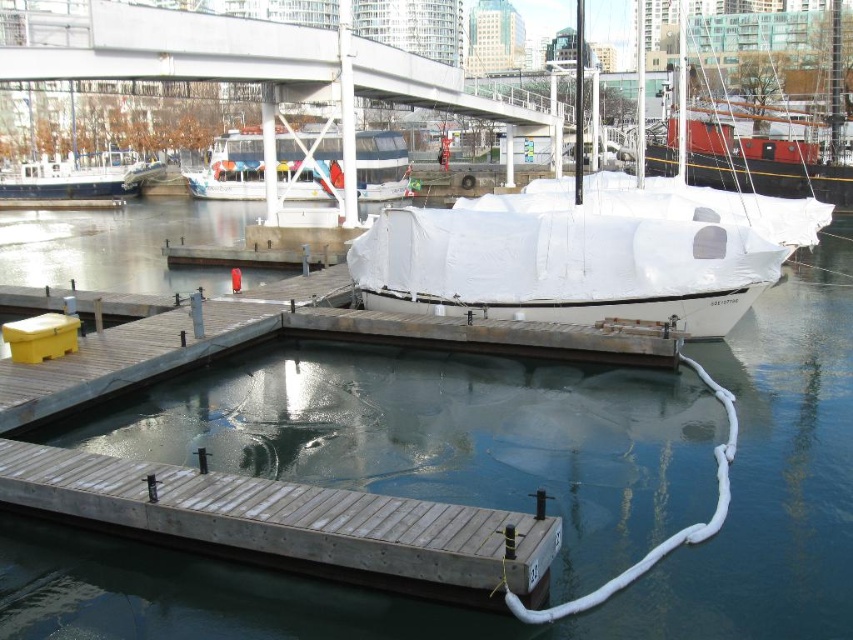
Can you confirm if white matte boat at center is wider than white matte boat at left?

Yes.

Which is more to the left, white matte boat at center or white matte boat at left?

Positioned to the left is white matte boat at left.

Identify the location of white matte boat at center. This screenshot has width=853, height=640. (567, 618).

Which is above, red matte sailboat at upper right or white glossy boat at center?

red matte sailboat at upper right is above.

Between red matte sailboat at upper right and white glossy boat at center, which one is positioned lower?

white glossy boat at center

Between point (839, 205) and point (241, 161), which one is positioned in front?

Point (839, 205) is more forward.

Find the location of a particular element. This screenshot has width=853, height=640. red matte sailboat at upper right is located at coordinates (770, 104).

Between red matte sailboat at upper right and white matte boat at left, which one has less height?

Standing shorter between the two is white matte boat at left.

Is red matte sailboat at upper right closer to camera compared to white matte boat at left?

Yes, it is.

Between point (747, 145) and point (148, 168), which one is positioned in front?

Point (747, 145) is more forward.

Where is `red matte sailboat at upper right`? The height and width of the screenshot is (640, 853). red matte sailboat at upper right is located at coordinates (770, 104).